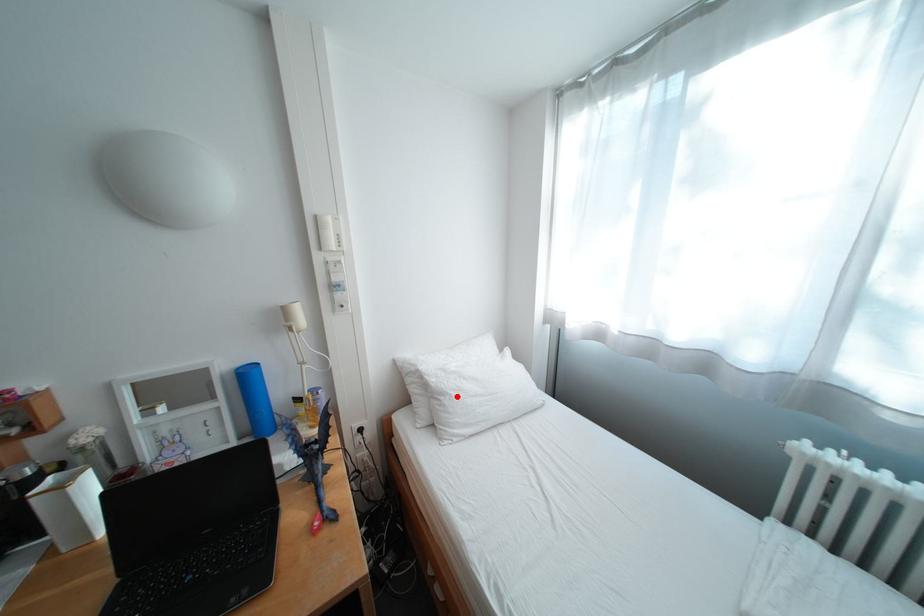
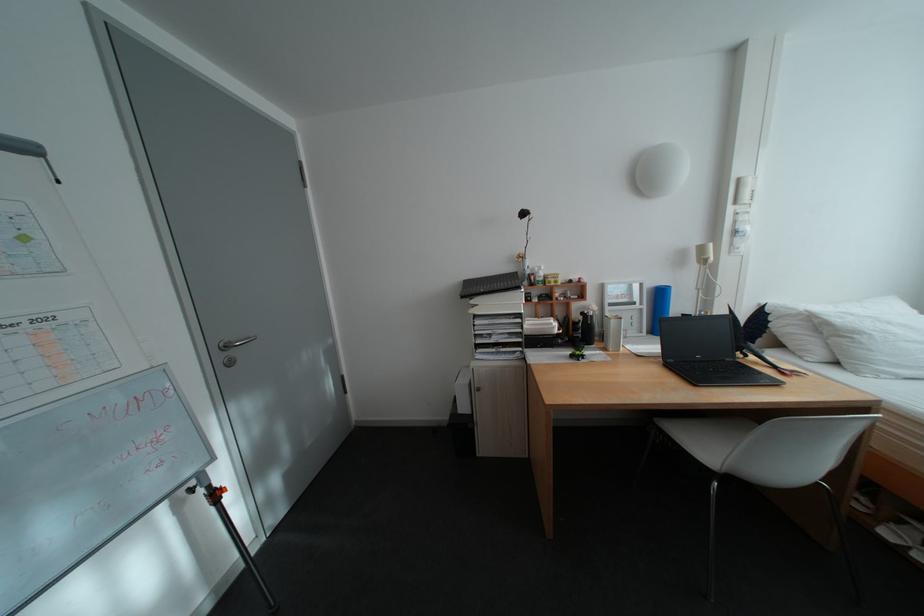
Question: I am providing you with two images of the same scene from different viewpoints. A red point is marked on the first image. Is the red point's position out of view in image 2?

Choices:
 (A) Yes
 (B) No

Answer: (B)